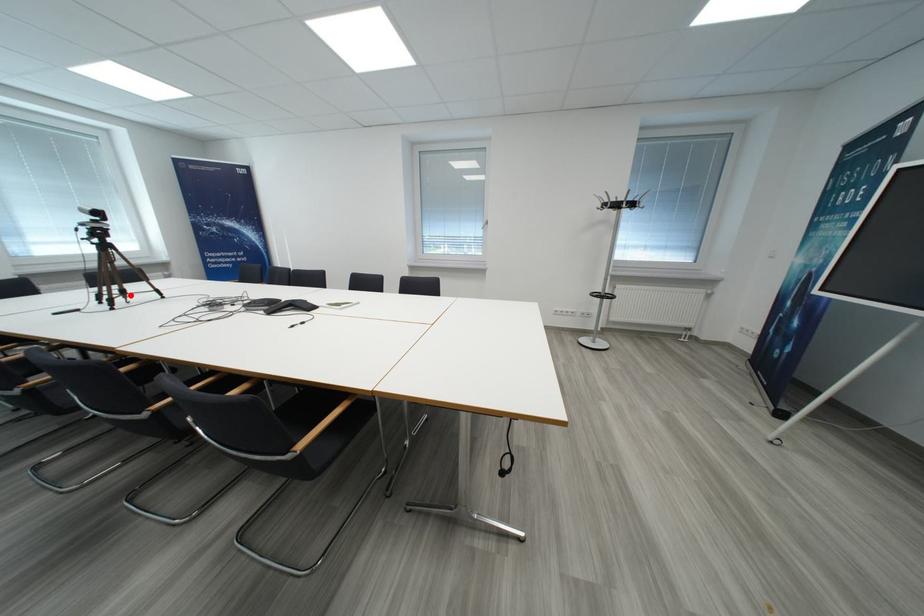
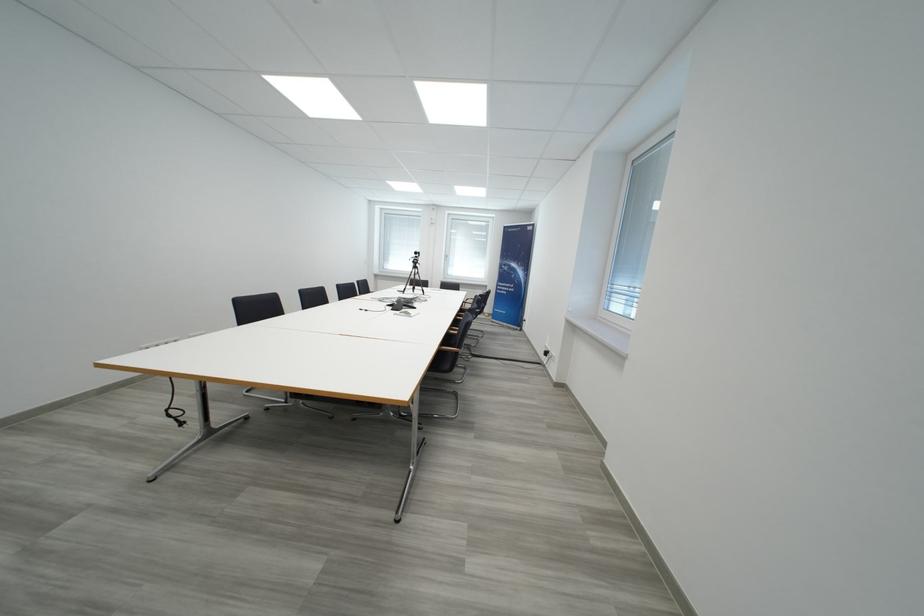
Question: I am providing you with two images of the same scene from different viewpoints. Given a red point in image1, look at the same physical point in image2. Is it:

Choices:
 (A) Closer to the viewpoint
 (B) Farther from the viewpoint

Answer: (A)